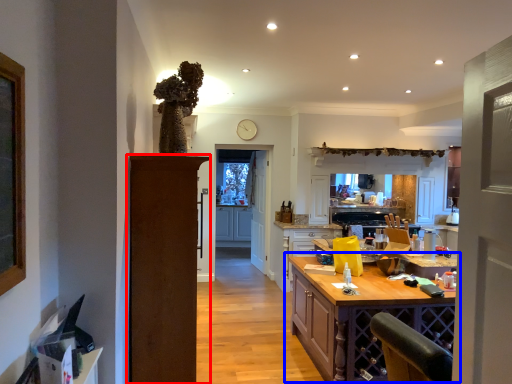
Question: Which object is closer to the camera taking this photo, door (highlighted by a red box) or table (highlighted by a blue box)?

Choices:
 (A) door
 (B) table

Answer: (A)